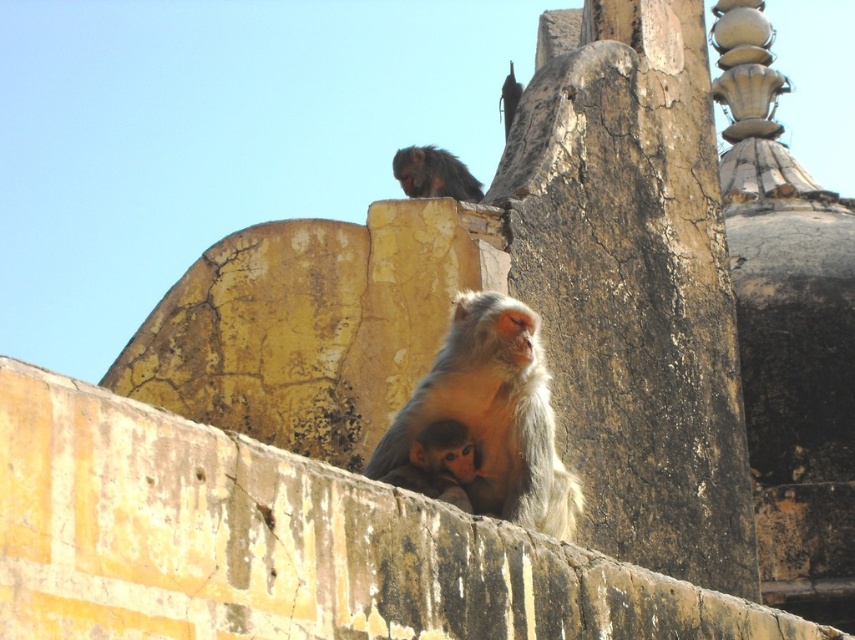
Measure the distance from golden fur monkey at center to light brown fur monkey at center.

A distance of 1.25 meters exists between golden fur monkey at center and light brown fur monkey at center.

Between golden fur monkey at center and light brown fur monkey at center, which one has more height?

Standing taller between the two is light brown fur monkey at center.

Measure the distance between golden fur monkey at center and camera.

golden fur monkey at center is 51.80 meters away from camera.

You are a GUI agent. You are given a task and a screenshot of the screen. Output one action in this format:
    pyautogui.click(x=<x>, y=<y>)
    Task: Click on the golden fur monkey at center
    
    Given the screenshot: What is the action you would take?
    pyautogui.click(x=493, y=416)

This screenshot has height=640, width=855. I want to click on light brown fur monkey at center, so click(438, 464).

Does light brown fur monkey at center have a lesser width compared to dark brown fur monkey at upper center?

Indeed, light brown fur monkey at center has a lesser width compared to dark brown fur monkey at upper center.

Who is more forward, (423, 429) or (417, 164)?

Point (423, 429) is in front.

Locate an element on the screen. This screenshot has width=855, height=640. light brown fur monkey at center is located at coordinates (438, 464).

Does golden fur monkey at center lie behind dark brown fur monkey at upper center?

That is False.

I want to click on golden fur monkey at center, so pos(493,416).

Is point (494, 438) positioned behind point (440, 195)?

No.

This screenshot has height=640, width=855. Identify the location of golden fur monkey at center. (493, 416).